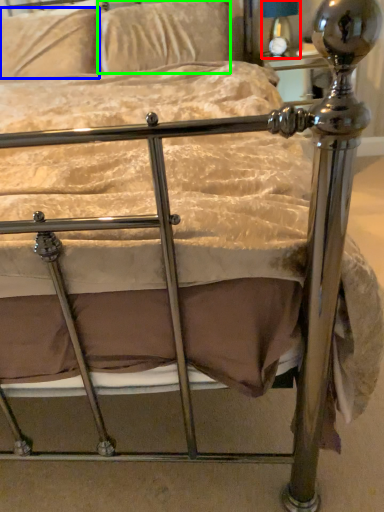
Question: Considering the real-world distances, which object is closest to table lamp (highlighted by a red box)? pillow (highlighted by a blue box) or pillow (highlighted by a green box).

Choices:
 (A) pillow
 (B) pillow

Answer: (B)